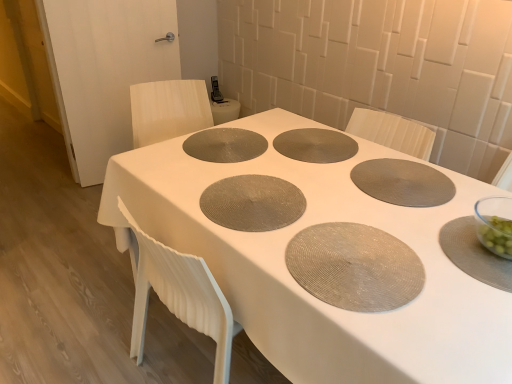
Where is `free space above matte gray placemat at center (from a real-world perspective)`? free space above matte gray placemat at center (from a real-world perspective) is located at coordinates (325, 203).